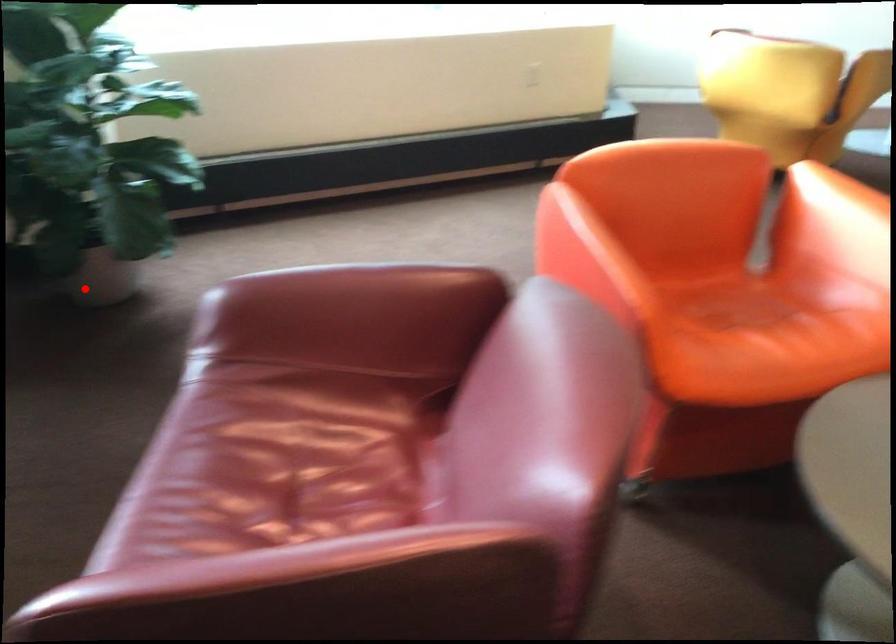
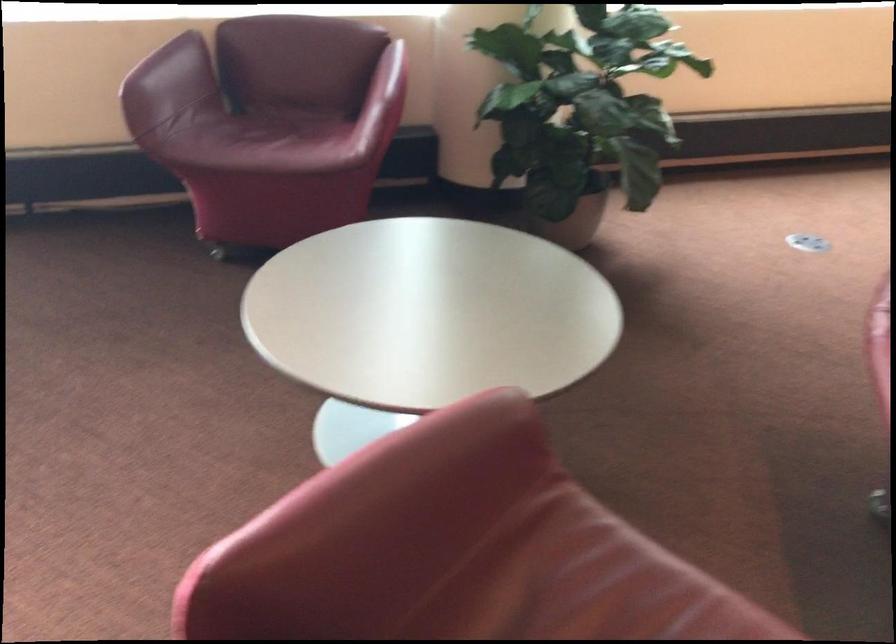
Find the pixel in the second image that matches the highlighted location in the first image.

(573, 223)